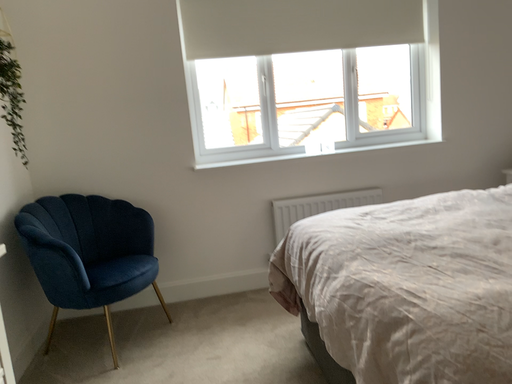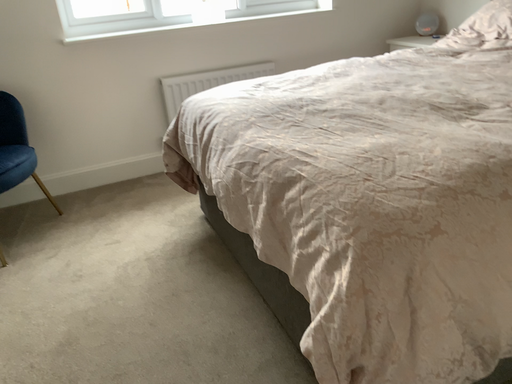
Question: How did the camera likely rotate when shooting the video?

Choices:
 (A) rotated right
 (B) rotated left

Answer: (A)